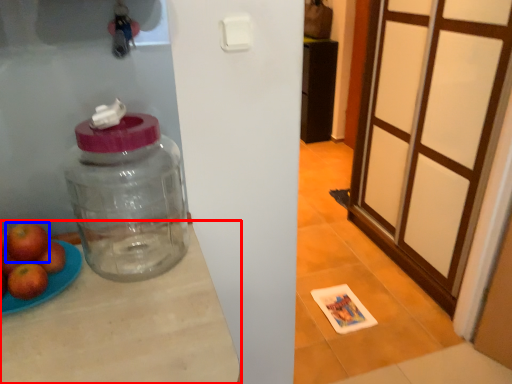
Question: Which of the following is the closest to the observer, table (highlighted by a red box) or apple (highlighted by a blue box)?

Choices:
 (A) table
 (B) apple

Answer: (A)